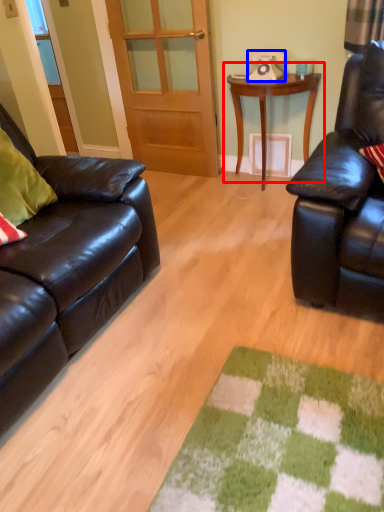
Question: Which object is closer to the camera taking this photo, table (highlighted by a red box) or corded phone (highlighted by a blue box)?

Choices:
 (A) table
 (B) corded phone

Answer: (A)